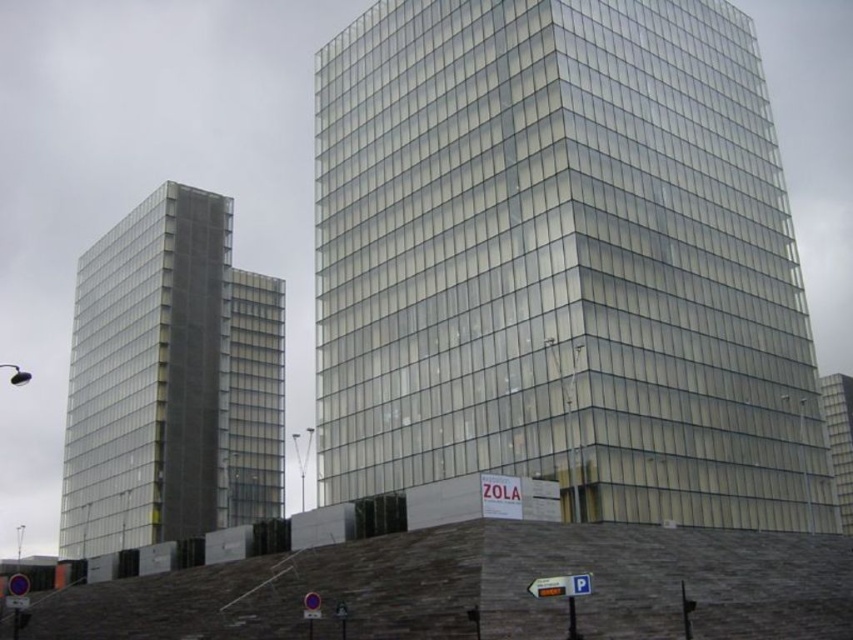
You are a delivery driver who needs to park your truck near the transparent glass building at center. The parking area in front of the transparent glass building at right is only 10 meters wide. Can your truck, which is 8 meters long, fit diagonally in that parking space?

The transparent glass building at center is much taller than the transparent glass building at right. However, the parking space width is unrelated to the buildings heights. Since the parking space is 10 meters wide, and the truck is 8 meters long, the truck can fit diagonally in the parking space as long as the diagonal length of the space is at least 8 meters. The parking space width is 10 meters, so the diagonal would be sqrt 10 squared plus length squared, but since the question only mentions width, it

In the scene shown: You are a delivery driver trying to park your truck in the parking lot near the transparent glass tower at left and transparent glass building at center. The parking lot has a slope. Which direction should you drive to reach the parking lot from the road?

You should drive towards the transparent glass tower at left because the transparent glass building at center is to the right of the transparent glass tower at left, so the slope leading to the parking lot is likely in the direction of the transparent glass tower at left.